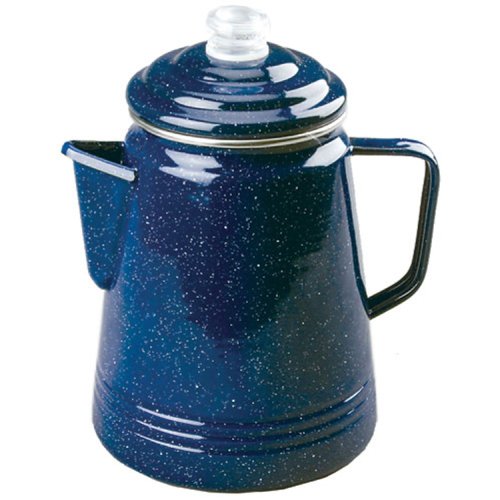
Identify the location of handle. This screenshot has height=500, width=500. (414, 150).